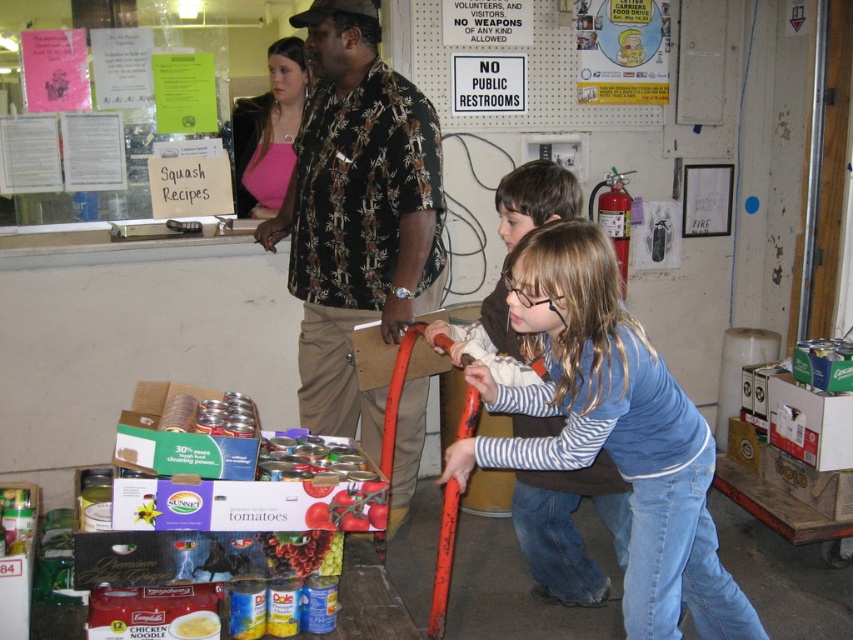
Who is more forward, [525,332] or [190,624]?

Positioned in front is point [525,332].

Is point (553, 260) closer to camera compared to point (206, 636)?

Yes, point (553, 260) is closer to viewer.

Find the location of a particular element. This screenshot has width=853, height=640. blue striped shirt at center is located at coordinates (612, 429).

Is point (692, 570) closer to camera compared to point (310, 540)?

No, (692, 570) is further to viewer.

From the picture: Who is positioned more to the left, blue striped shirt at center or shiny metallic can at center?

shiny metallic can at center

Describe the element at coordinates (612, 429) in the screenshot. I see `blue striped shirt at center` at that location.

What are the coordinates of `blue striped shirt at center` in the screenshot? It's located at (612, 429).

Does blue striped shirt at center appear under pink matte shirt at upper center?

Yes.

Who is taller, blue striped shirt at center or pink matte shirt at upper center?

blue striped shirt at center

I want to click on blue striped shirt at center, so click(612, 429).

Locate an element on the screen. The width and height of the screenshot is (853, 640). blue striped shirt at center is located at coordinates (612, 429).